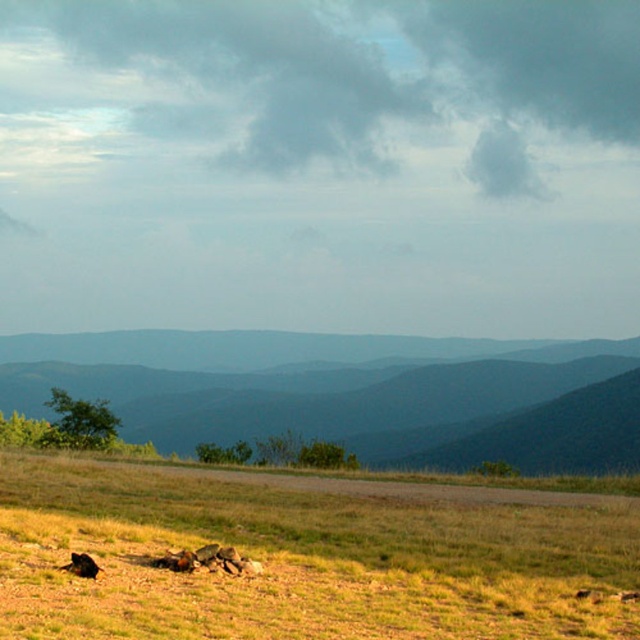
You are standing at the shiny black dog at lower left and want to walk to the green grassy hillside at center. Which direction should you head?

You should head to the right because the green grassy hillside at center is located to the right of the shiny black dog at lower left.

You are standing at the bottom left corner of the image where the small pile of rocks is located. You want to walk directly towards the green grassy hillside at center. In which general direction should you head?

The green grassy hillside at center is located at point (x=349, y=392), which is to the upper right direction from your current position at the bottom left corner. You should head towards the upper right direction.